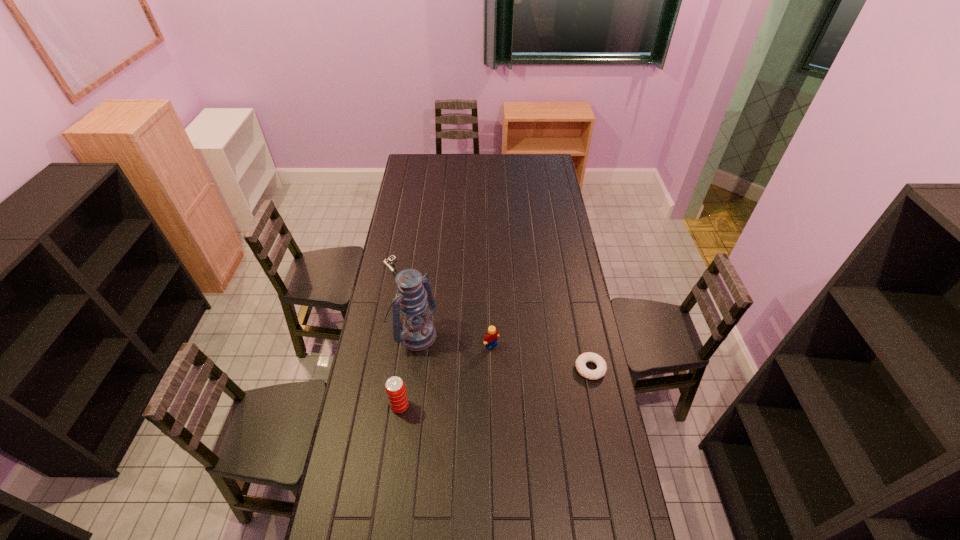
This screenshot has height=540, width=960. In order to click on soda can in this screenshot , I will do `click(395, 389)`.

Where is `the fourth shortest object`? The image size is (960, 540). the fourth shortest object is located at coordinates (395, 389).

Where is `doughnut`? The image size is (960, 540). doughnut is located at coordinates 581,361.

This screenshot has height=540, width=960. Find the location of `the fourth tallest object`. the fourth tallest object is located at coordinates (581, 361).

The image size is (960, 540). In order to click on the tallest object in this screenshot , I will do `click(415, 331)`.

The width and height of the screenshot is (960, 540). In order to click on the shortest object in this screenshot , I will do `click(388, 262)`.

At what (x,y) coordinates should I click in order to perform the action: click on the farthest object. Please return your answer as a coordinate pair (x, y). The image size is (960, 540). Looking at the image, I should click on (388, 262).

In order to click on the third tallest object in this screenshot , I will do `click(490, 340)`.

Identify the location of Lego. The height and width of the screenshot is (540, 960). (490, 340).

Locate an element on the screen. free location located 0.280m on the back of the soda can is located at coordinates (409, 336).